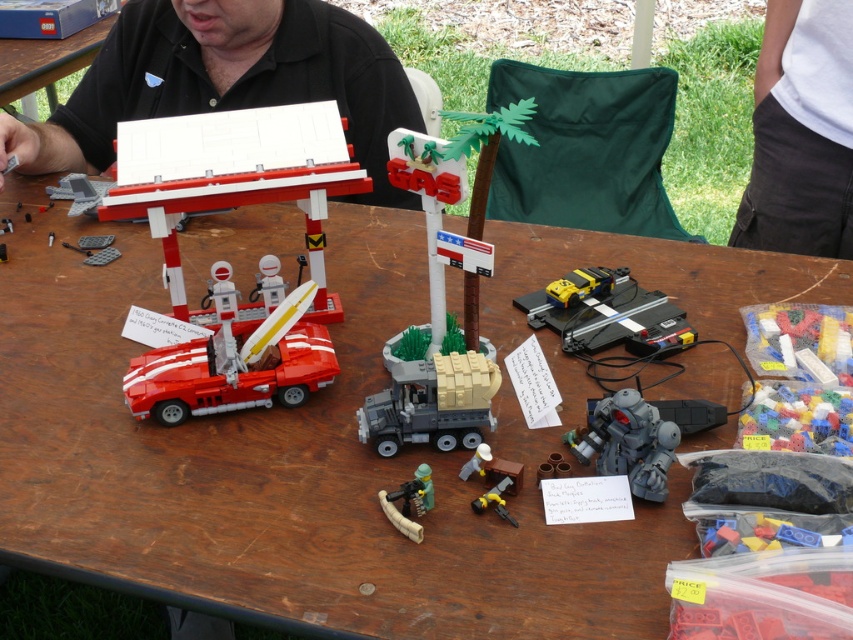
You are organizing a display for a LEGO exhibition and need to place a new LEGO set that requires 30 centimeters of space between the matte red car at left and the gray plastic truck at center. Is there enough space between them?

The distance between the matte red car at left and the gray plastic truck at center is 24.71 centimeters, which is less than the required 30 centimeters. Therefore, there is not enough space between them for the new LEGO set.

You are organizing a community event and need to decide which item to place in a display case that can only accommodate larger items. Which item from the table should you choose between the black matte shirt at upper center and the metallic silver gun at center?

The black matte shirt at upper center has a larger size compared to the metallic silver gun at center, so you should choose the black matte shirt at upper center for the display case.